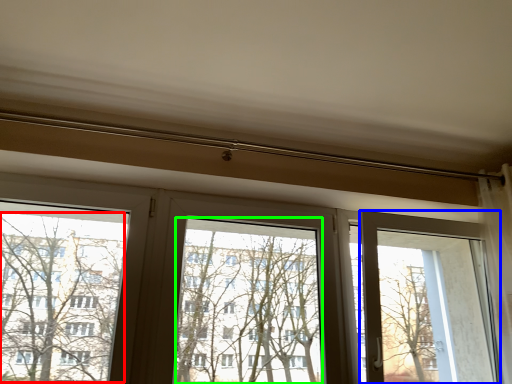
Question: Which object is the closest to the tree (highlighted by a red box)? Choose among these: screen door (highlighted by a blue box) or window screen (highlighted by a green box).

Choices:
 (A) screen door
 (B) window screen

Answer: (B)